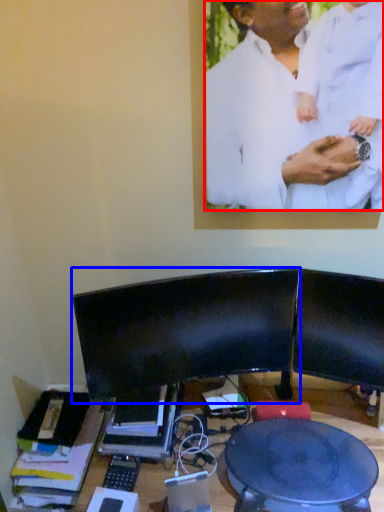
Question: Which object is closer to the camera taking this photo, man (highlighted by a red box) or computer monitor (highlighted by a blue box)?

Choices:
 (A) man
 (B) computer monitor

Answer: (A)